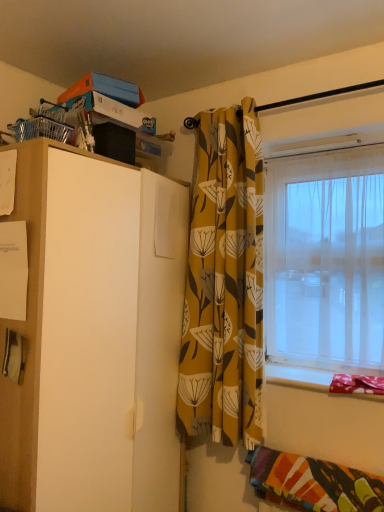
Locate an element on the screen. This screenshot has width=384, height=512. white matte cabinet at left is located at coordinates (95, 336).

Where is `multicolored woven blanket at lower right`? The image size is (384, 512). multicolored woven blanket at lower right is located at coordinates (313, 484).

You are a GUI agent. You are given a task and a screenshot of the screen. Output one action in this format:
    pyautogui.click(x=<x>, y=<y>)
    Task: Click on the fabric covered window sill at lower right
    The height and width of the screenshot is (512, 384).
    Given the screenshot: What is the action you would take?
    (x=299, y=378)

What is the approximate height of transparent plastic window at right?

88.28 centimeters.

In order to face yellow floral fabric curtain at center, should I rotate leftwards or rightwards?

You should look right and rotate roughly 3.411 degrees.

This screenshot has height=512, width=384. In order to click on white matte cabinet at left in this screenshot , I will do `click(95, 336)`.

Is white matte cabinet at left spatially inside fabric covered window sill at lower right, or outside of it?

white matte cabinet at left is not inside fabric covered window sill at lower right, it's outside.

Which object is thinner, white matte cabinet at left or fabric covered window sill at lower right?

Thinner between the two is fabric covered window sill at lower right.

From a real-world perspective, is white matte cabinet at left physically above fabric covered window sill at lower right?

Yes, from a real-world perspective, white matte cabinet at left is above fabric covered window sill at lower right.

This screenshot has width=384, height=512. Find the location of `cabinetry in front of the fabric covered window sill at lower right`. cabinetry in front of the fabric covered window sill at lower right is located at coordinates (95, 336).

From a real-world perspective, between fabric covered window sill at lower right and multicolored woven blanket at lower right, who is vertically lower?

multicolored woven blanket at lower right.

Is fabric covered window sill at lower right shorter than multicolored woven blanket at lower right?

Correct, fabric covered window sill at lower right is not as tall as multicolored woven blanket at lower right.

From the image's perspective, between fabric covered window sill at lower right and multicolored woven blanket at lower right, who is located below?

multicolored woven blanket at lower right appears lower in the image.

Is fabric covered window sill at lower right wider or thinner than multicolored woven blanket at lower right?

Considering their sizes, fabric covered window sill at lower right looks broader than multicolored woven blanket at lower right.

Considering the positions of objects yellow floral fabric curtain at center and fabric covered window sill at lower right in the image provided, who is more to the left, yellow floral fabric curtain at center or fabric covered window sill at lower right?

yellow floral fabric curtain at center.

From a real-world perspective, is yellow floral fabric curtain at center located beneath fabric covered window sill at lower right?

No, from a real-world perspective, yellow floral fabric curtain at center is not below fabric covered window sill at lower right.

Image resolution: width=384 pixels, height=512 pixels. Find the location of `window sill in front of the yellow floral fabric curtain at center`. window sill in front of the yellow floral fabric curtain at center is located at coordinates (299, 378).

Is yellow floral fabric curtain at center further to the viewer compared to fabric covered window sill at lower right?

Yes, yellow floral fabric curtain at center is further from the camera.

Is yellow floral fabric curtain at center outside of transparent plastic window at right?

Yes, yellow floral fabric curtain at center is located beyond the bounds of transparent plastic window at right.

Considering their positions, is yellow floral fabric curtain at center located in front of or behind transparent plastic window at right?

yellow floral fabric curtain at center is positioned closer to the viewer than transparent plastic window at right.

Based on the photo, how different are the orientations of yellow floral fabric curtain at center and transparent plastic window at right in degrees?

The angular difference between yellow floral fabric curtain at center and transparent plastic window at right is 0.000862 degrees.

Does transparent plastic window at right turn towards multicolored woven blanket at lower right?

No, transparent plastic window at right is not aimed at multicolored woven blanket at lower right.

Could multicolored woven blanket at lower right be considered to be inside transparent plastic window at right?

No, multicolored woven blanket at lower right is not surrounded by transparent plastic window at right.

Considering the relative positions of transparent plastic window at right and multicolored woven blanket at lower right in the image provided, is transparent plastic window at right to the left or to the right of multicolored woven blanket at lower right?

Clearly, transparent plastic window at right is on the right of multicolored woven blanket at lower right in the image.

Is transparent plastic window at right shorter than multicolored woven blanket at lower right?

Incorrect, the height of transparent plastic window at right does not fall short of that of multicolored woven blanket at lower right.

Considering the sizes of objects multicolored woven blanket at lower right and yellow floral fabric curtain at center in the image provided, who is smaller, multicolored woven blanket at lower right or yellow floral fabric curtain at center?

multicolored woven blanket at lower right is smaller.

Would you say yellow floral fabric curtain at center is part of multicolored woven blanket at lower right's contents?

No.

Visually, is multicolored woven blanket at lower right positioned to the left or to the right of yellow floral fabric curtain at center?

multicolored woven blanket at lower right is to the right of yellow floral fabric curtain at center.

Can you confirm if multicolored woven blanket at lower right is wider than yellow floral fabric curtain at center?

Indeed, multicolored woven blanket at lower right has a greater width compared to yellow floral fabric curtain at center.

Would you say transparent plastic window at right is inside or outside fabric covered window sill at lower right?

transparent plastic window at right exists outside the volume of fabric covered window sill at lower right.

Which object is further away from the camera taking this photo, transparent plastic window at right or fabric covered window sill at lower right?

Positioned behind is transparent plastic window at right.

Does transparent plastic window at right appear on the left side of fabric covered window sill at lower right?

Yes.

From the image's perspective, does transparent plastic window at right appear higher than fabric covered window sill at lower right?

Yes.

Image resolution: width=384 pixels, height=512 pixels. I want to click on cabinetry above the fabric covered window sill at lower right (from the image's perspective), so click(x=95, y=336).

The width and height of the screenshot is (384, 512). What are the coordinates of `blanket that is under the fabric covered window sill at lower right (from a real-world perspective)` in the screenshot? It's located at (313, 484).

Which object lies nearer to the anchor point multicolored woven blanket at lower right, yellow floral fabric curtain at center or fabric covered window sill at lower right?

Among the two, fabric covered window sill at lower right is located nearer to multicolored woven blanket at lower right.

When comparing their distances from white matte cabinet at left, does yellow floral fabric curtain at center or transparent plastic window at right seem closer?

yellow floral fabric curtain at center is closer to white matte cabinet at left.

Considering their positions, is multicolored woven blanket at lower right positioned closer to white matte cabinet at left than yellow floral fabric curtain at center?

The object closer to white matte cabinet at left is yellow floral fabric curtain at center.

Estimate the real-world distances between objects in this image. Which object is closer to multicolored woven blanket at lower right, fabric covered window sill at lower right or white matte cabinet at left?

Based on the image, fabric covered window sill at lower right appears to be nearer to multicolored woven blanket at lower right.

Which object lies further to the anchor point yellow floral fabric curtain at center, multicolored woven blanket at lower right or white matte cabinet at left?

The object further to yellow floral fabric curtain at center is multicolored woven blanket at lower right.

When comparing their distances from transparent plastic window at right, does multicolored woven blanket at lower right or yellow floral fabric curtain at center seem further?

multicolored woven blanket at lower right is further to transparent plastic window at right.

Which object lies further to the anchor point white matte cabinet at left, transparent plastic window at right or fabric covered window sill at lower right?

Based on the image, fabric covered window sill at lower right appears to be further to white matte cabinet at left.

Estimate the real-world distances between objects in this image. Which object is further from transparent plastic window at right, fabric covered window sill at lower right or yellow floral fabric curtain at center?

Among the two, fabric covered window sill at lower right is located further to transparent plastic window at right.

At what (x,y) coordinates should I click in order to perform the action: click on blanket located between white matte cabinet at left and fabric covered window sill at lower right in the left-right direction. Please return your answer as a coordinate pair (x, y). This screenshot has width=384, height=512. Looking at the image, I should click on (313, 484).

Find the location of a particular element. The height and width of the screenshot is (512, 384). window sill between yellow floral fabric curtain at center and multicolored woven blanket at lower right from top to bottom is located at coordinates click(299, 378).

I want to click on curtain between transparent plastic window at right and multicolored woven blanket at lower right from top to bottom, so click(x=224, y=282).

Locate an element on the screen. The image size is (384, 512). blanket between white matte cabinet at left and transparent plastic window at right in the horizontal direction is located at coordinates (313, 484).